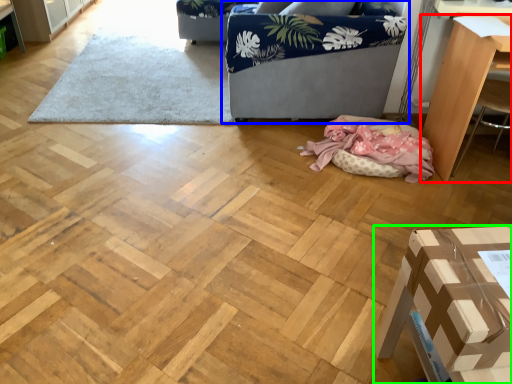
Question: Which object is positioned closest to furniture (highlighted by a red box)? Select from studio couch (highlighted by a blue box) and furniture (highlighted by a green box).

Choices:
 (A) studio couch
 (B) furniture

Answer: (A)